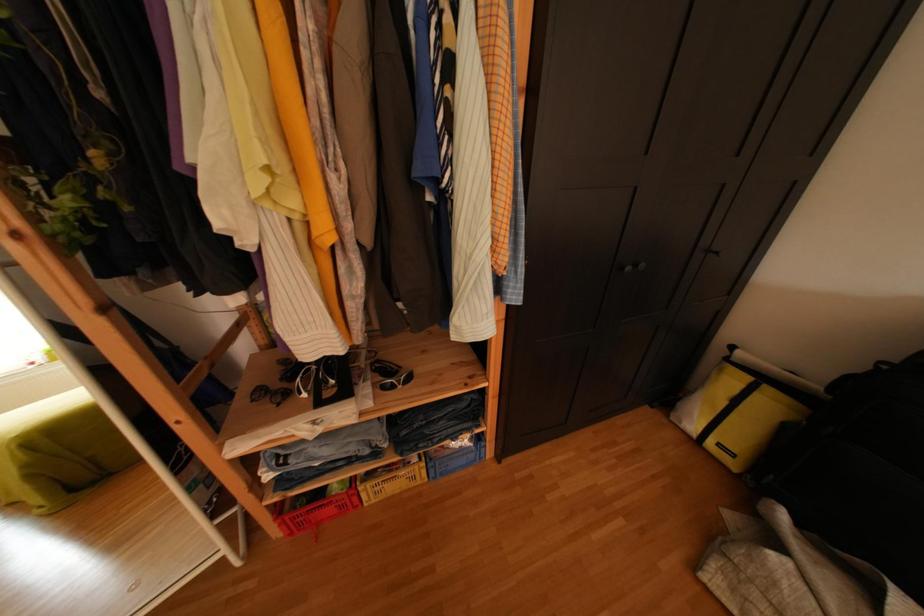
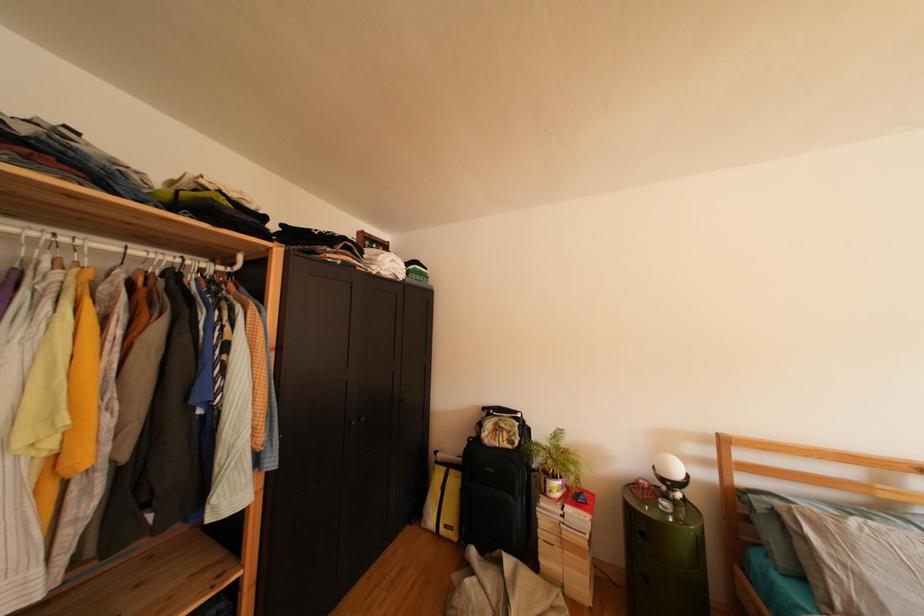
The first image is from the beginning of the video and the second image is from the end. How did the camera likely rotate when shooting the video?

The camera rotated toward right-up.